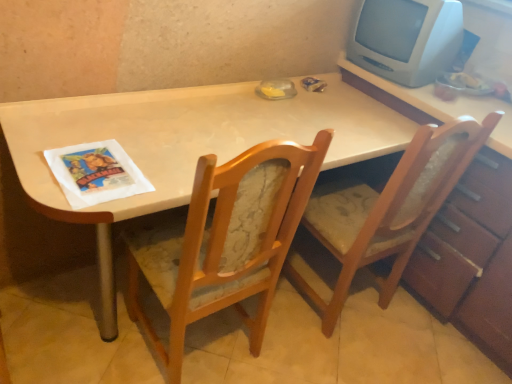
Find the location of a particular element. free location in front of wooden textured chair at right, which is the second chair from left to right is located at coordinates (333, 356).